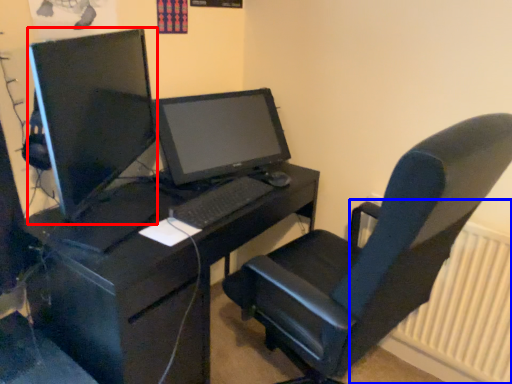
Question: Among these objects, which one is farthest to the camera, computer monitor (highlighted by a red box) or radiator (highlighted by a blue box)?

Choices:
 (A) computer monitor
 (B) radiator

Answer: (B)